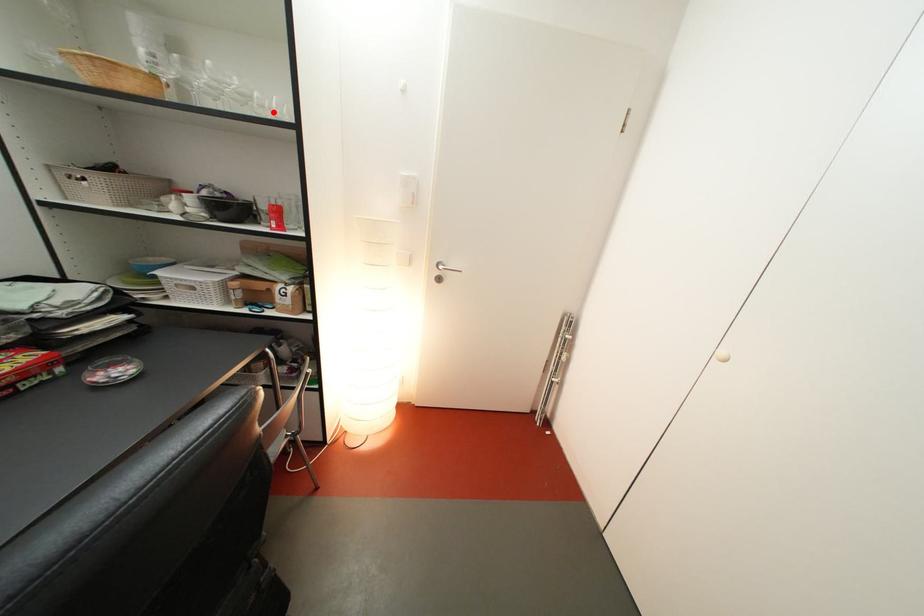
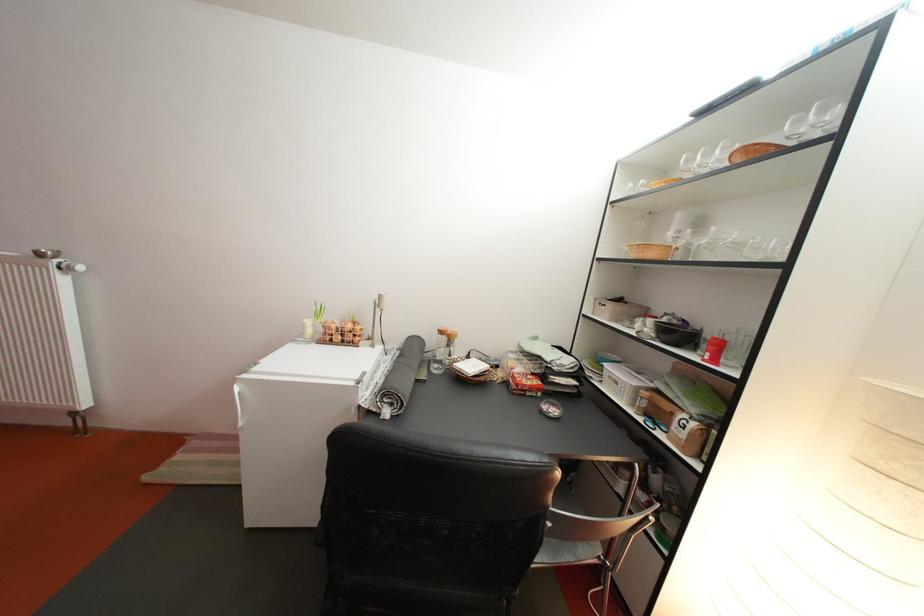
Find the pixel in the second image that matches the highlighted location in the first image.

(770, 254)